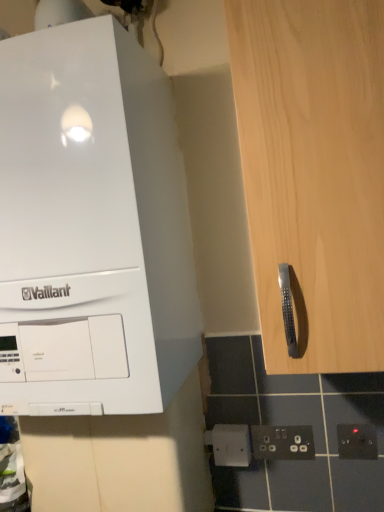
Question: Is white plastic electric outlet at lower center, which ranks as the 1th electric outlet in left-to-right order, bigger or smaller than white glossy vaillant boiler at upper left?

Choices:
 (A) big
 (B) small

Answer: (B)

Question: From their relative heights in the image, would you say white plastic electric outlet at lower center, positioned as the third electric outlet in right-to-left order, is taller or shorter than white glossy vaillant boiler at upper left?

Choices:
 (A) short
 (B) tall

Answer: (A)

Question: Based on their relative distances, which object is farther from the white glossy vaillant boiler at upper left?

Choices:
 (A) white plastic socket at lower center, marked as the second electric outlet in a right-to-left arrangement
 (B) black plastic electric outlet at lower right, which ranks as the third electric outlet in left-to-right order
 (C) light wood cabinet handle at right
 (D) white plastic electric outlet at lower center, positioned as the third electric outlet in right-to-left order

Answer: (B)

Question: Which object is positioned closest to the black plastic electric outlet at lower right, which ranks as the third electric outlet in left-to-right order?

Choices:
 (A) white glossy vaillant boiler at upper left
 (B) light wood cabinet handle at right
 (C) white plastic electric outlet at lower center, positioned as the third electric outlet in right-to-left order
 (D) white plastic socket at lower center, which is the second electric outlet in left-to-right order

Answer: (D)